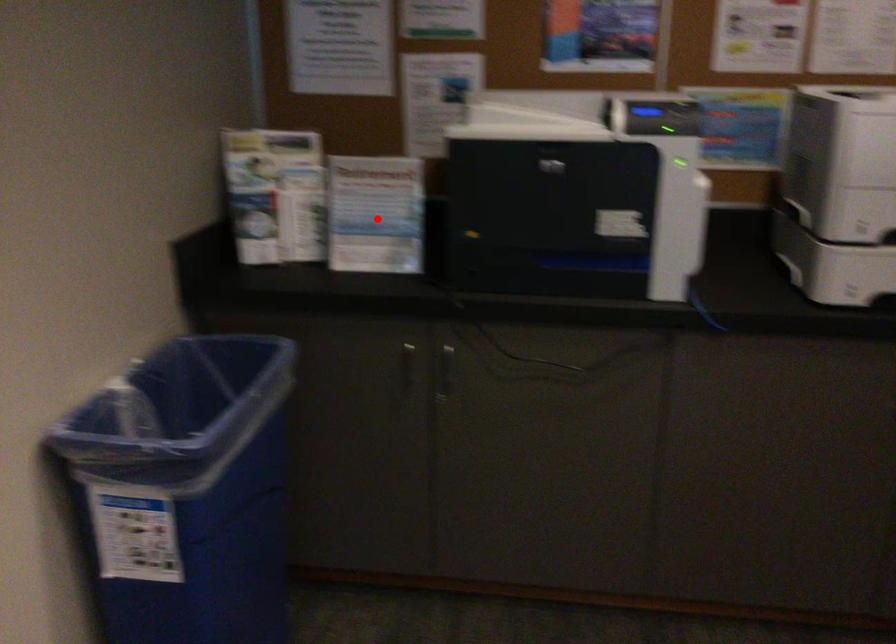
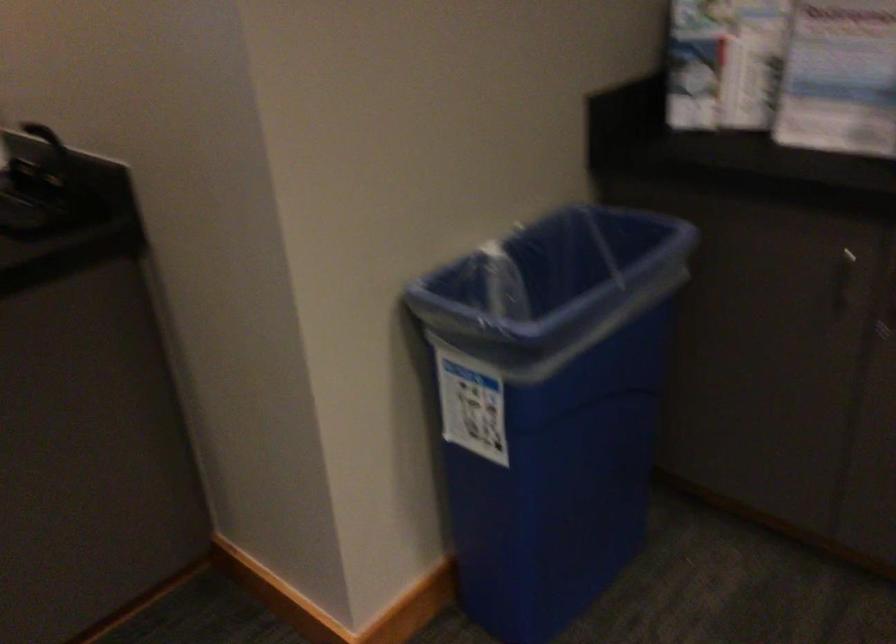
Question: I am providing you with two images of the same scene from different viewpoints. Image1 has a red point marked. In image2, the corresponding 3D location appears at what relative position? Reply with the corresponding letter.

Choices:
 (A) Closer
 (B) Farther

Answer: (A)